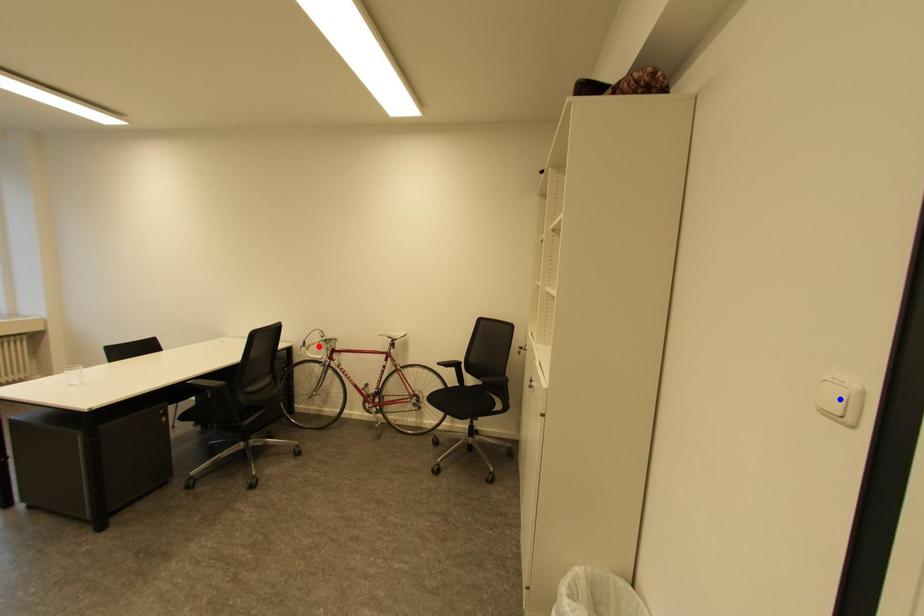
Question: Which of the two points in the image is closer to the camera?

Choices:
 (A) Blue point is closer.
 (B) Red point is closer.

Answer: (A)